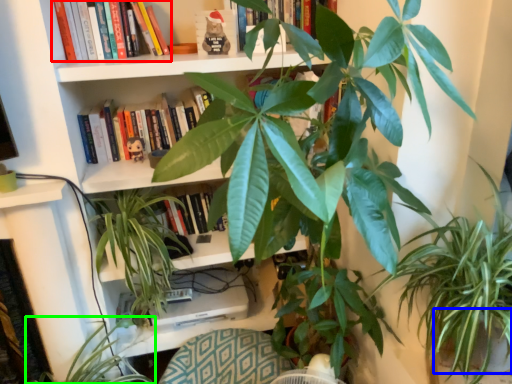
Question: Estimate the real-world distances between objects in this image. Which object is farther from book (highlighted by a red box), flowerpot (highlighted by a blue box) or houseplant (highlighted by a green box)?

Choices:
 (A) flowerpot
 (B) houseplant

Answer: (A)